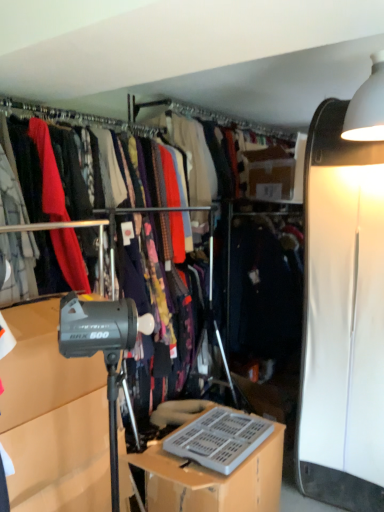
This screenshot has height=512, width=384. Find the location of `gray plastic keyboard at lower center`. gray plastic keyboard at lower center is located at coordinates (215, 464).

The image size is (384, 512). What do you see at coordinates (215, 464) in the screenshot? I see `gray plastic keyboard at lower center` at bounding box center [215, 464].

What is the approximate width of gray plastic keyboard at lower center?

The width of gray plastic keyboard at lower center is 18.56 inches.

Measure the distance between point (75, 380) and camera.

Point (75, 380) and camera are 1.54 meters apart.

At what (x,y) coordinates should I click in order to perform the action: click on gray matte tripod at lower left. Please return your answer as a coordinate pair (x, y). Looking at the image, I should click on (53, 418).

Image resolution: width=384 pixels, height=512 pixels. What do you see at coordinates (53, 418) in the screenshot?
I see `gray matte tripod at lower left` at bounding box center [53, 418].

Measure the distance between gray matte tripod at lower left and camera.

A distance of 4.22 feet exists between gray matte tripod at lower left and camera.

Image resolution: width=384 pixels, height=512 pixels. Find the location of `gray plastic keyboard at lower center`. gray plastic keyboard at lower center is located at coordinates (215, 464).

Which object is positioned more to the left, gray matte tripod at lower left or gray plastic keyboard at lower center?

From the viewer's perspective, gray matte tripod at lower left appears more on the left side.

Between gray matte tripod at lower left and gray plastic keyboard at lower center, which one is positioned in front?

gray matte tripod at lower left is more forward.

Does point (56, 476) come in front of point (164, 458)?

That is True.

From the image's perspective, is gray matte tripod at lower left located above or below gray plastic keyboard at lower center?

From the image's perspective, gray matte tripod at lower left appears above gray plastic keyboard at lower center.

From a real-world perspective, is gray matte tripod at lower left physically below gray plastic keyboard at lower center?

Actually, gray matte tripod at lower left is physically above gray plastic keyboard at lower center in the real world.

Which object is wider, gray matte tripod at lower left or gray plastic keyboard at lower center?

Wider between the two is gray plastic keyboard at lower center.

Considering the sizes of objects gray matte tripod at lower left and gray plastic keyboard at lower center in the image provided, who is shorter, gray matte tripod at lower left or gray plastic keyboard at lower center?

Standing shorter between the two is gray plastic keyboard at lower center.

Considering the relative sizes of gray matte tripod at lower left and gray plastic keyboard at lower center in the image provided, is gray matte tripod at lower left smaller than gray plastic keyboard at lower center?

Yes, gray matte tripod at lower left is smaller than gray plastic keyboard at lower center.

Is gray matte tripod at lower left positioned beyond the bounds of gray plastic keyboard at lower center?

gray matte tripod at lower left lies outside gray plastic keyboard at lower center's area.

Is gray matte tripod at lower left far away from gray plastic keyboard at lower center?

No.

From the picture: Is gray matte tripod at lower left turned away from gray plastic keyboard at lower center?

gray matte tripod at lower left is not turned away from gray plastic keyboard at lower center.

How much distance is there between gray matte tripod at lower left and gray plastic keyboard at lower center?

gray matte tripod at lower left and gray plastic keyboard at lower center are 17.64 inches apart from each other.

The image size is (384, 512). In order to click on desk located behind the gray matte tripod at lower left in this screenshot , I will do `click(215, 464)`.

Which is more to the left, gray plastic keyboard at lower center or gray matte tripod at lower left?

gray matte tripod at lower left.

Considering the positions of objects gray plastic keyboard at lower center and gray matte tripod at lower left in the image provided, who is in front, gray plastic keyboard at lower center or gray matte tripod at lower left?

gray matte tripod at lower left is in front.

Which is farther from the camera, (190, 441) or (34, 442)?

The point (190, 441) is farther.

From the image's perspective, is gray plastic keyboard at lower center on top of gray matte tripod at lower left?

No, from the image's perspective, gray plastic keyboard at lower center is not over gray matte tripod at lower left.

From a real-world perspective, is gray plastic keyboard at lower center positioned above or below gray matte tripod at lower left?

gray plastic keyboard at lower center is situated lower than gray matte tripod at lower left in the real world.

Considering the sizes of objects gray plastic keyboard at lower center and gray matte tripod at lower left in the image provided, who is wider, gray plastic keyboard at lower center or gray matte tripod at lower left?

gray plastic keyboard at lower center.

Does gray plastic keyboard at lower center have a greater height compared to gray matte tripod at lower left?

Incorrect, the height of gray plastic keyboard at lower center is not larger of that of gray matte tripod at lower left.

Does gray plastic keyboard at lower center have a larger size compared to gray matte tripod at lower left?

Yes.

Is gray plastic keyboard at lower center spatially inside gray matte tripod at lower left, or outside of it?

gray plastic keyboard at lower center is located beyond the bounds of gray matte tripod at lower left.

In the scene shown: Would you say gray plastic keyboard at lower center is a long distance from gray matte tripod at lower left?

No, there isn't a large distance between gray plastic keyboard at lower center and gray matte tripod at lower left.

Is gray plastic keyboard at lower center positioned with its back to gray matte tripod at lower left?

gray plastic keyboard at lower center is not turned away from gray matte tripod at lower left.

The image size is (384, 512). I want to click on desk lying below the gray matte tripod at lower left (from the image's perspective), so click(x=215, y=464).

Find the location of a particular element. The width and height of the screenshot is (384, 512). cabinetry above the gray plastic keyboard at lower center (from the image's perspective) is located at coordinates (53, 418).

Locate an element on the screen. The height and width of the screenshot is (512, 384). desk located behind the gray matte tripod at lower left is located at coordinates (215, 464).